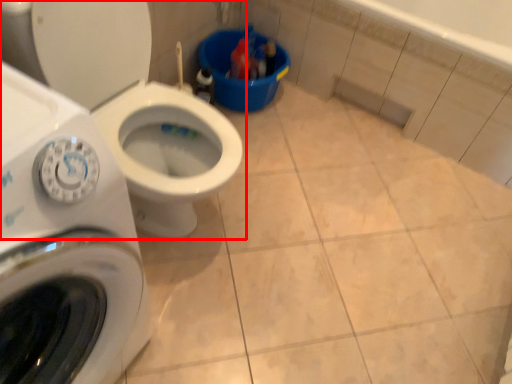
Question: From the image's perspective, where is toilet (annotated by the red box) located relative to washing machine?

Choices:
 (A) below
 (B) above

Answer: (B)